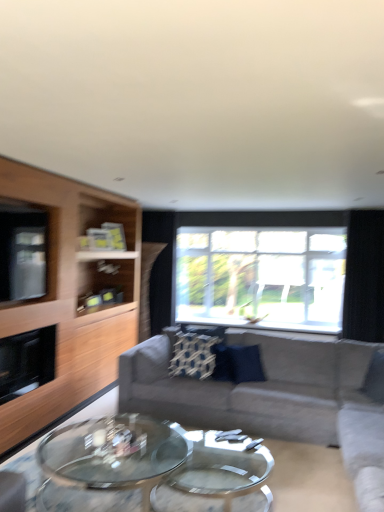
Question: Considering the relative sizes of transparent glass window at center and gray fabric couch at center in the image provided, is transparent glass window at center thinner than gray fabric couch at center?

Choices:
 (A) no
 (B) yes

Answer: (B)

Question: From a real-world perspective, is transparent glass window at center on gray fabric couch at center?

Choices:
 (A) no
 (B) yes

Answer: (B)

Question: Is transparent glass window at center further to the viewer compared to gray fabric couch at center?

Choices:
 (A) no
 (B) yes

Answer: (B)

Question: Is transparent glass window at center facing away from gray fabric couch at center?

Choices:
 (A) no
 (B) yes

Answer: (A)

Question: Is transparent glass window at center at the left side of gray fabric couch at center?

Choices:
 (A) no
 (B) yes

Answer: (A)

Question: From a real-world perspective, is transparent glass coffee table at center above or below transparent glass window at center?

Choices:
 (A) above
 (B) below

Answer: (B)

Question: In the image, is transparent glass coffee table at center positioned in front of or behind transparent glass window at center?

Choices:
 (A) front
 (B) behind

Answer: (A)

Question: Based on their positions, is transparent glass coffee table at center located to the left or right of transparent glass window at center?

Choices:
 (A) left
 (B) right

Answer: (A)

Question: Does point (125, 501) appear closer or farther from the camera than point (241, 253)?

Choices:
 (A) farther
 (B) closer

Answer: (B)

Question: Considering the positions of point (11, 275) and point (74, 452), is point (11, 275) closer or farther from the camera than point (74, 452)?

Choices:
 (A) farther
 (B) closer

Answer: (A)

Question: Is clear glass window screen at left in front of or behind transparent glass coffee table at center in the image?

Choices:
 (A) behind
 (B) front

Answer: (A)

Question: From a real-world perspective, is clear glass window screen at left physically located above or below transparent glass coffee table at center?

Choices:
 (A) above
 (B) below

Answer: (A)

Question: Considering the positions of clear glass window screen at left and transparent glass coffee table at center in the image, is clear glass window screen at left taller or shorter than transparent glass coffee table at center?

Choices:
 (A) short
 (B) tall

Answer: (B)

Question: In terms of width, does light wood entertainment center at left look wider or thinner when compared to transparent glass coffee table at center?

Choices:
 (A) thin
 (B) wide

Answer: (A)

Question: Visually, is light wood entertainment center at left positioned to the left or to the right of transparent glass coffee table at center?

Choices:
 (A) right
 (B) left

Answer: (B)